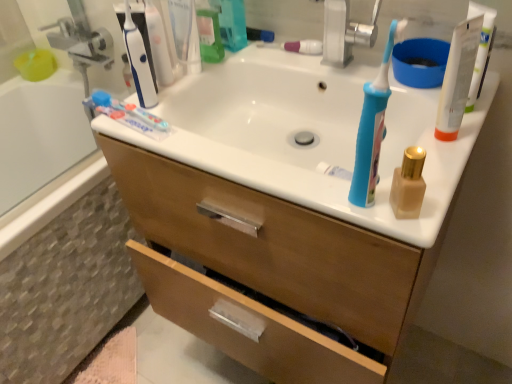
Describe the element at coordinates (408, 184) in the screenshot. I see `matte gold bottle at right` at that location.

Locate an element on the screen. white glossy sink at center is located at coordinates (308, 130).

Identify the location of pink glossy toothpaste at center, the second toothpaste positioned from the front. This screenshot has height=384, width=512. (304, 47).

The height and width of the screenshot is (384, 512). What do you see at coordinates (293, 190) in the screenshot? I see `wooden cabinet at center` at bounding box center [293, 190].

How much space does white glossy toothpaste at upper left, placed as the second toothpaste when sorted from right to left, occupy vertically?

white glossy toothpaste at upper left, placed as the second toothpaste when sorted from right to left, is 2.58 centimeters in height.

At what (x,y) coordinates should I click in order to perform the action: click on white plastic tube at upper right. Please return your answer as a coordinate pair (x, y). Image resolution: width=512 pixels, height=384 pixels. Looking at the image, I should click on (457, 78).

The height and width of the screenshot is (384, 512). What do you see at coordinates (457, 78) in the screenshot? I see `white plastic tube at upper right` at bounding box center [457, 78].

Find the location of a particular element. The height and width of the screenshot is (384, 512). matte gold bottle at right is located at coordinates (408, 184).

From the image's perspective, which one is positioned higher, white glossy sink at center or matte gold bottle at right?

From the image's view, white glossy sink at center is above.

This screenshot has width=512, height=384. What are the coordinates of `mouthwash above the white glossy sink at center (from a real-world perspective)` in the screenshot? It's located at (408, 184).

From a real-world perspective, is white glossy sink at center positioned under matte gold bottle at right based on gravity?

Correct, in the physical world, white glossy sink at center is lower than matte gold bottle at right.

Considering their positions, is white glossy sink at center located in front of or behind matte gold bottle at right?

white glossy sink at center is behind matte gold bottle at right.

Is silver metallic faucet at upper center to the left of matte gold bottle at right from the viewer's perspective?

Correct, you'll find silver metallic faucet at upper center to the left of matte gold bottle at right.

From the image's perspective, would you say silver metallic faucet at upper center is positioned over matte gold bottle at right?

Yes, from the image's perspective, silver metallic faucet at upper center is over matte gold bottle at right.

Locate an element on the screen. faucet above the matte gold bottle at right (from the image's perspective) is located at coordinates (345, 32).

Is the surface of wooden cabinet at center in direct contact with white plastic tube at upper right?

wooden cabinet at center is not next to white plastic tube at upper right, and they're not touching.

Does point (161, 96) come closer to viewer compared to point (464, 39)?

No, it is behind (464, 39).

Between wooden cabinet at center and white plastic tube at upper right, which one appears on the right side from the viewer's perspective?

white plastic tube at upper right is more to the right.

Which object is closer to the camera taking this photo, wooden cabinet at center or white plastic tube at upper right?

wooden cabinet at center is in front.

Which of these two, white plastic tube at upper right or white glossy sink at center, is smaller?

white plastic tube at upper right.

Could you tell me if white plastic tube at upper right is turned towards white glossy sink at center?

No, white plastic tube at upper right does not turn towards white glossy sink at center.

Based on the photo, in terms of height, does white plastic tube at upper right look taller or shorter compared to white glossy sink at center?

white plastic tube at upper right is taller than white glossy sink at center.

Does silver metallic faucet at upper center contain pink glossy toothpaste at center, the 1th toothpaste from the right?

No, pink glossy toothpaste at center, the 1th toothpaste from the right, is not a part of silver metallic faucet at upper center.

Which of these two, silver metallic faucet at upper center or pink glossy toothpaste at center, the second toothpaste positioned from the front, is smaller?

pink glossy toothpaste at center, the second toothpaste positioned from the front, is smaller.

Could you tell me if silver metallic faucet at upper center is facing pink glossy toothpaste at center, arranged as the second toothpaste when viewed from the left?

No, silver metallic faucet at upper center is not turned towards pink glossy toothpaste at center, arranged as the second toothpaste when viewed from the left.

How many degrees apart are the facing directions of wooden cabinet at center and matte gold bottle at right?

0.87 degrees.

From the image's perspective, which is above, wooden cabinet at center or matte gold bottle at right?

matte gold bottle at right.

Which is less distant, (x=278, y=229) or (x=408, y=194)?

Clearly, point (x=278, y=229) is more distant from the camera than point (x=408, y=194).

Choose the correct answer: Is wooden cabinet at center inside matte gold bottle at right or outside it?

wooden cabinet at center is outside matte gold bottle at right.

From the image's perspective, who appears lower, white plastic tube at upper right or matte gold bottle at right?

From the image's view, matte gold bottle at right is below.

Where is `mouthwash on the left of the white plastic tube at upper right`? mouthwash on the left of the white plastic tube at upper right is located at coordinates (408, 184).

Considering the sizes of objects white plastic tube at upper right and matte gold bottle at right in the image provided, who is wider, white plastic tube at upper right or matte gold bottle at right?

With larger width is white plastic tube at upper right.

Can you confirm if white plastic tube at upper right is positioned to the right of matte gold bottle at right?

Yes.

Image resolution: width=512 pixels, height=384 pixels. Find the location of `sink on the left side of matte gold bottle at right`. sink on the left side of matte gold bottle at right is located at coordinates (308, 130).

Identify the location of faucet lying above the matte gold bottle at right (from the image's perspective). This screenshot has width=512, height=384. (345, 32).

When comparing their distances from white plastic tube at upper right, does blue plastic toothbrush at upper right or silver metallic faucet at upper center seem further?

silver metallic faucet at upper center is further to white plastic tube at upper right.

Looking at the image, which one is located further to matte gold bottle at right, pink glossy toothpaste at center, the 1th toothpaste from the right, or wooden cabinet at center?

Among the two, pink glossy toothpaste at center, the 1th toothpaste from the right, is located further to matte gold bottle at right.

Looking at the image, which one is located further to wooden cabinet at center, blue plastic toothbrush at upper right or matte gold bottle at right?

matte gold bottle at right.

From the image, which object appears to be nearer to blue plastic toothbrush at upper right, white glossy toothpaste at upper left, which is counted as the second toothpaste, starting from the top, or white glossy sink at center?

white glossy sink at center lies closer to blue plastic toothbrush at upper right than the other object.

Based on their spatial positions, is wooden cabinet at center or pink glossy toothpaste at center, the second toothpaste positioned from the front, closer to white glossy sink at center?

wooden cabinet at center is positioned closer to the anchor white glossy sink at center.

Considering their positions, is white glossy sink at center positioned closer to blue plastic toothbrush at upper right than white glossy toothpaste at upper left, arranged as the 2th toothpaste when viewed from the back?

Based on the image, white glossy sink at center appears to be nearer to blue plastic toothbrush at upper right.

Which object lies nearer to the anchor point blue plastic toothbrush at upper right, matte gold bottle at right or pink glossy toothpaste at center, the first toothpaste from the back?

Among the two, matte gold bottle at right is located nearer to blue plastic toothbrush at upper right.

From the image, which object appears to be farther from white glossy toothpaste at upper left, the first toothpaste ordered from the bottom, wooden cabinet at center or white glossy sink at center?

wooden cabinet at center is positioned further to the anchor white glossy toothpaste at upper left, the first toothpaste ordered from the bottom.

Find the location of a particular element. faucet positioned between white plastic tube at upper right and pink glossy toothpaste at center, the first toothpaste from the back, from near to far is located at coordinates (345, 32).

Identify the location of mouthwash between blue plastic toothbrush at upper right and pink glossy toothpaste at center, the second toothpaste positioned from the bottom, along the z-axis. (408, 184).

This screenshot has width=512, height=384. I want to click on toothpaste between white glossy toothpaste at upper left, the first toothpaste ordered from the bottom, and silver metallic faucet at upper center from left to right, so click(304, 47).

This screenshot has height=384, width=512. Find the location of `faucet between pink glossy toothpaste at center, the first toothpaste from the back, and wooden cabinet at center vertically`. faucet between pink glossy toothpaste at center, the first toothpaste from the back, and wooden cabinet at center vertically is located at coordinates point(345,32).